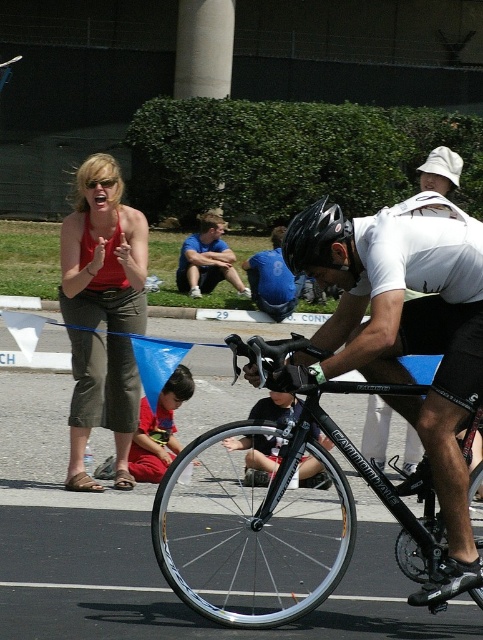
You are a drone operator trying to capture aerial footage of the cycling event. You have two points marked on your map for drone takeoff and landing. The first point is at coordinate point(458, 250) and the second point is at coordinate point(88, 310). If you want to ensure the drone flies over the event area without obstruction, which point should you choose for takeoff to be closer to the event area?

Point(458, 250) is in front of point(88, 310), so choosing point(458, 250) for takeoff would place the drone closer to the event area, ensuring better coverage without obstruction.

You are a photographer positioned at the starting line of the cycling event. You need to capture a photo that includes both the shiny black bike at center and the blue jersey at center. Considering their sizes, which object should you frame first to ensure both are fully visible in the photo?

The shiny black bike at center is wider than the blue jersey at center, so you should frame the shiny black bike at center first to ensure both objects are fully visible in the photo.

What is the exact coordinate of the shiny black bike at center?

The shiny black bike at center is located at point (x=278, y=525).